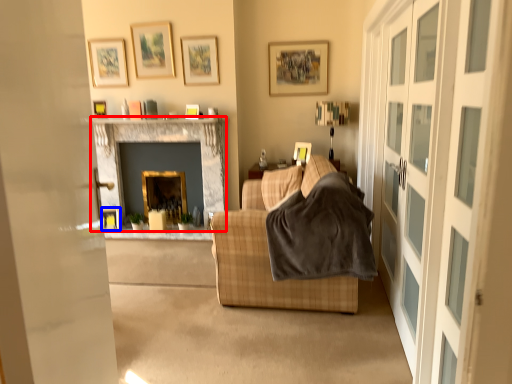
Question: Which point is closer to the camera, fireplace (highlighted by a red box) or picture frame (highlighted by a blue box)?

Choices:
 (A) fireplace
 (B) picture frame

Answer: (A)